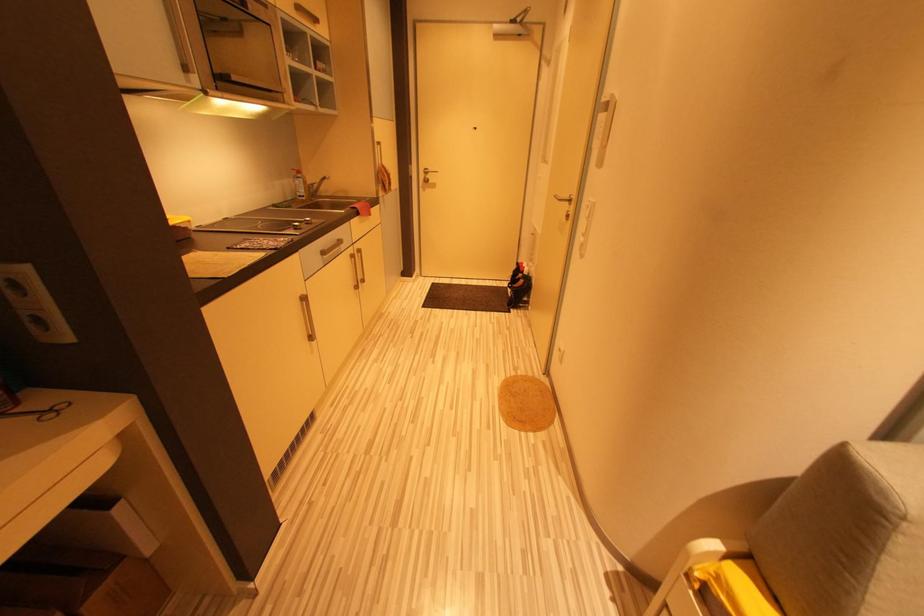
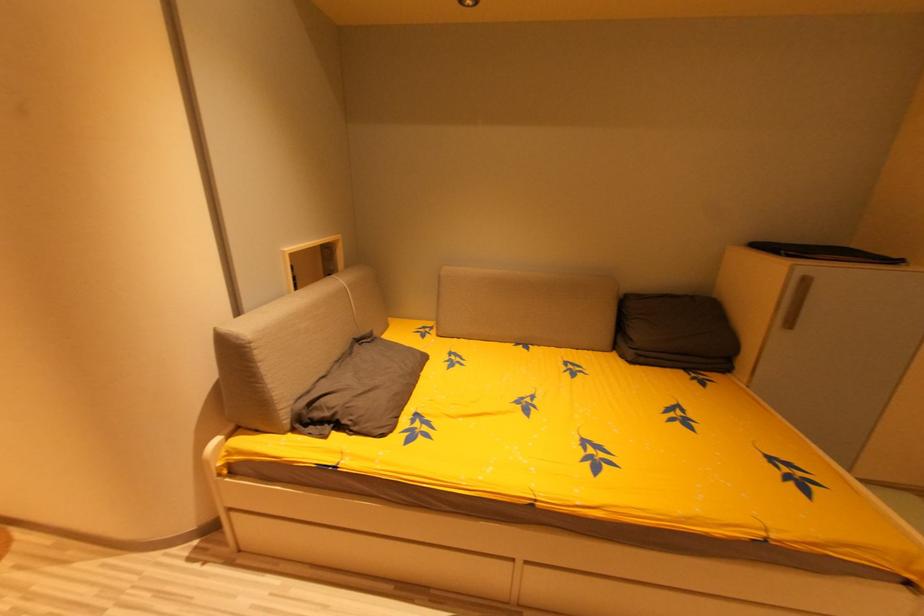
The images are taken continuously from a first-person perspective. In which direction is your viewpoint rotating?

The rotation direction of the camera is right-down.